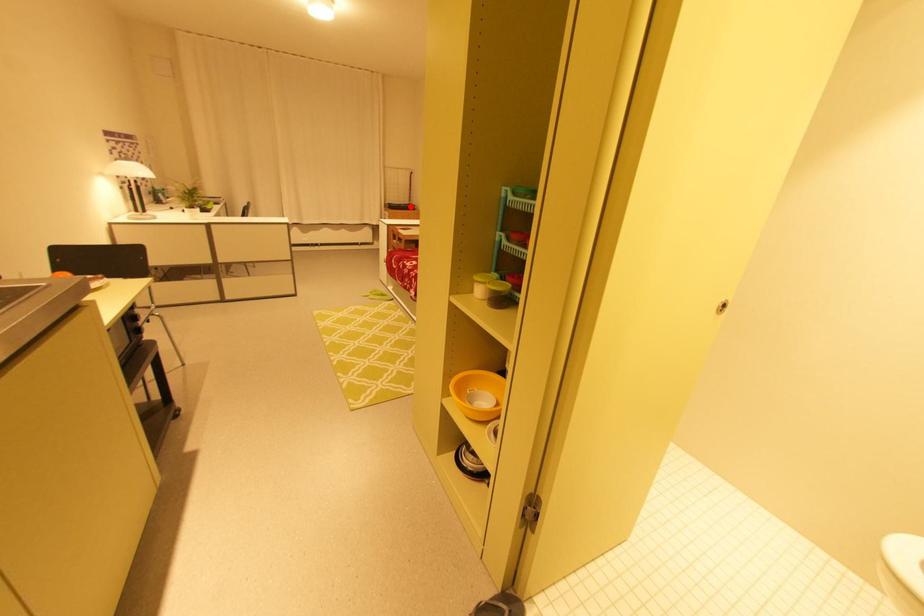
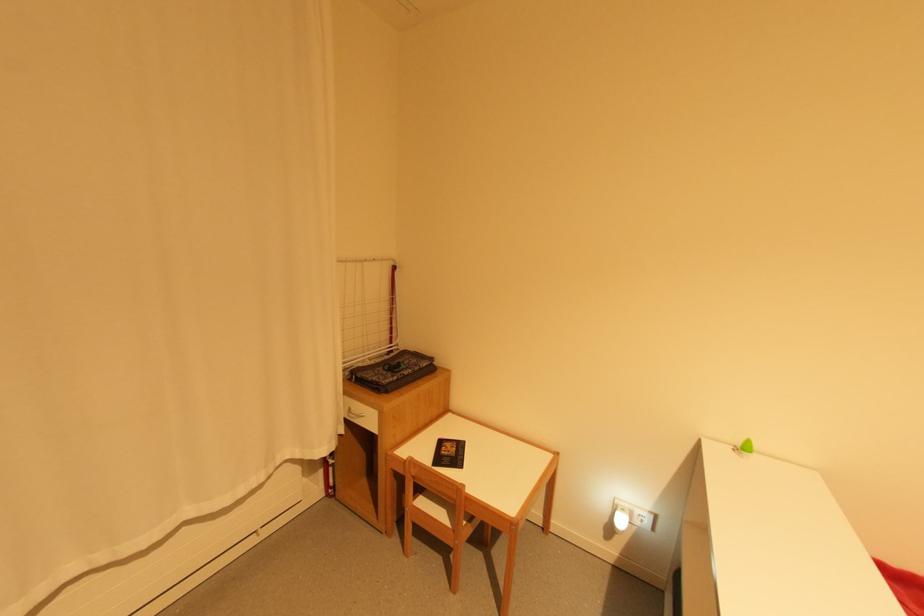
Question: I am providing you with two images of the same scene from different viewpoints. A red point is marked on the first image. Can you still see the location of the red point in image 2?

Choices:
 (A) Yes
 (B) No

Answer: (A)